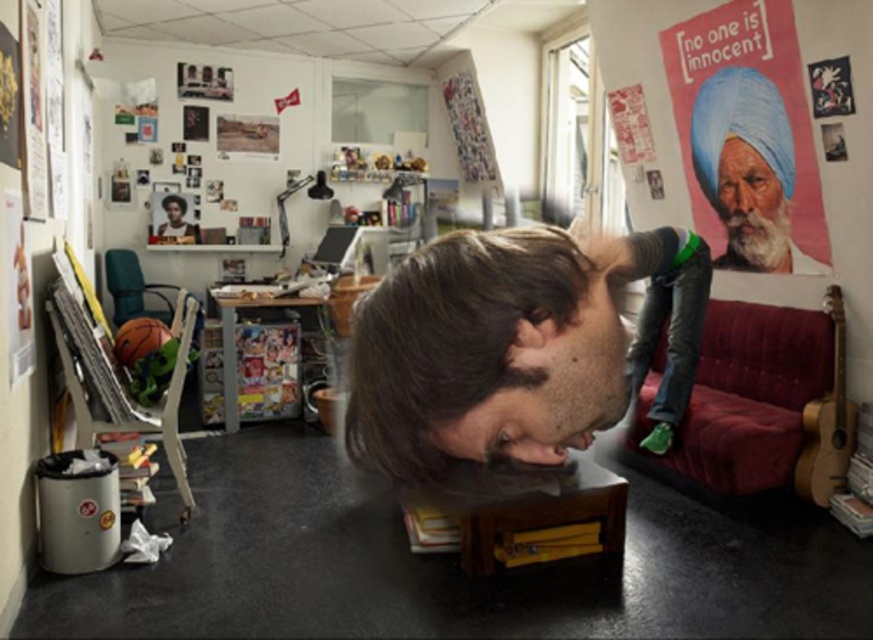
Who is more forward, (740, 268) or (713, 262)?

Point (740, 268)

Who is more distant from viewer, (768, 193) or (753, 253)?

Positioned behind is point (753, 253).

Find the location of a particular element. The image size is (873, 640). white beard at upper right is located at coordinates (751, 211).

Can you confirm if matte plastic poster at upper right is positioned to the left of smooth blue fabric at upper right?

Incorrect, matte plastic poster at upper right is not on the left side of smooth blue fabric at upper right.

Based on the photo, is the position of matte plastic poster at upper right more distant than that of smooth blue fabric at upper right?

That is False.

Identify the location of matte plastic poster at upper right. (748, 170).

Which of these two, white fluffy beard at upper right or smooth blue fabric at upper right, stands taller?

white fluffy beard at upper right

Is point (732, 211) closer to viewer compared to point (748, 138)?

No, (732, 211) is further to viewer.

Measure the distance between white fluffy beard at upper right and camera.

11.76 feet

Image resolution: width=873 pixels, height=640 pixels. Find the location of `white fluffy beard at upper right`. white fluffy beard at upper right is located at coordinates (757, 240).